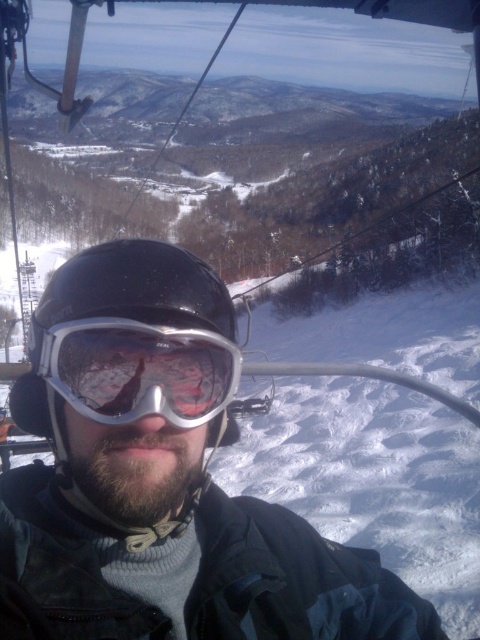
Where is the black matte helmet at center located in the image?

The black matte helmet at center is located at point coordinates of approximately 0.609 on the x axis and 0.271 on the y axis.

You are a photographer trying to capture a clear shot of the matte black helmet at center and the black matte helmet at center. However, you notice that one of them is partially obscured by a tree branch. Which helmet is more likely to be visible in your photo?

The matte black helmet at center is taller than the black matte helmet at center, so the matte black helmet at center is more likely to be visible as it is positioned higher and less likely to be blocked by the tree branch.